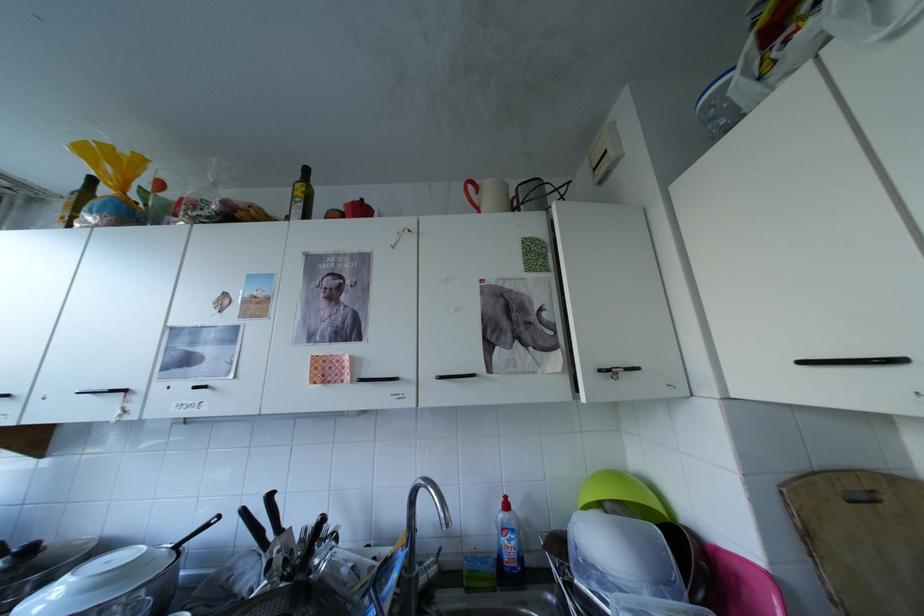
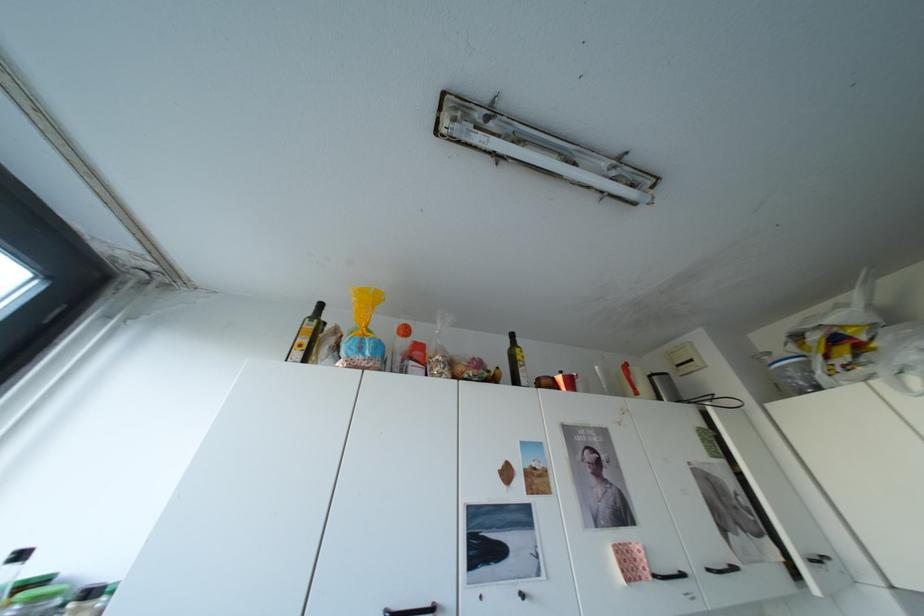
Locate, in the second image, the point that corresponds to the point at 613,371 in the first image.

(824, 561)